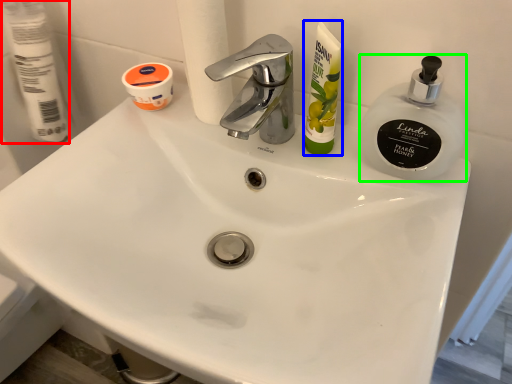
Question: Which object is positioned farthest from toilet paper (highlighted by a red box)? Select from toiletry (highlighted by a blue box) and soap dispenser (highlighted by a green box).

Choices:
 (A) toiletry
 (B) soap dispenser

Answer: (B)